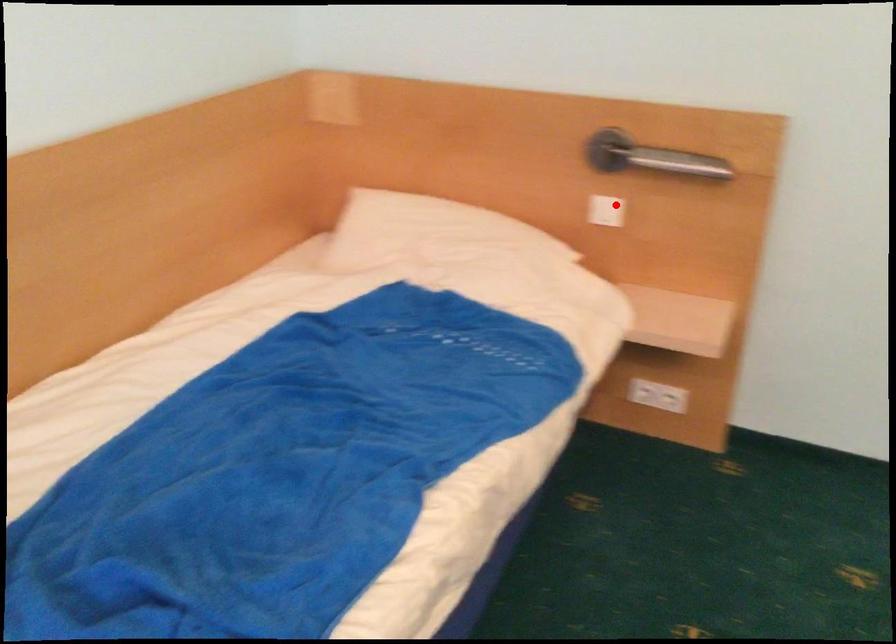
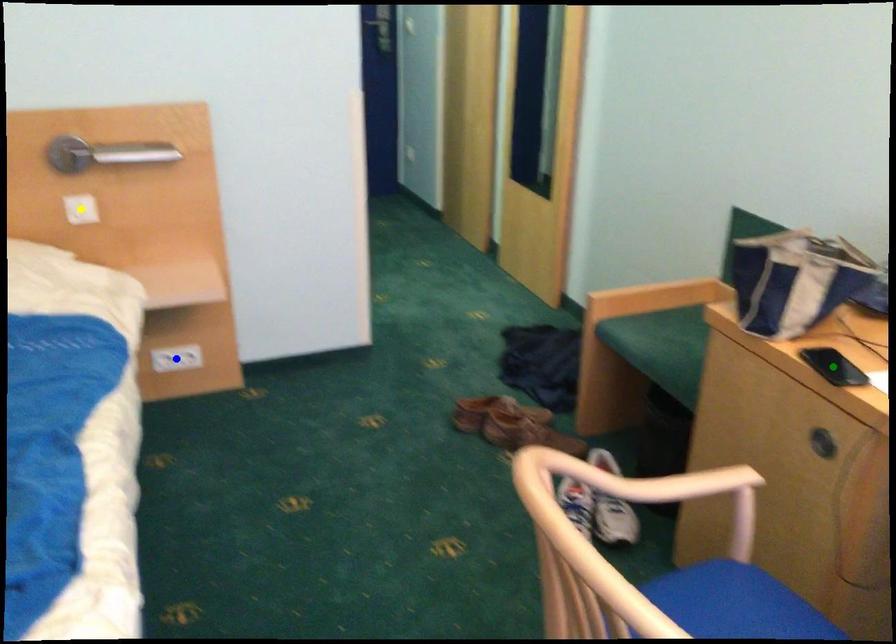
Question: I am providing you with two images of the same scene from different viewpoints. A red point is marked on the first image. You are given multiple points on the second image. Which mark in image 2 goes with the point in image 1?

Choices:
 (A) green point
 (B) yellow point
 (C) blue point

Answer: (B)